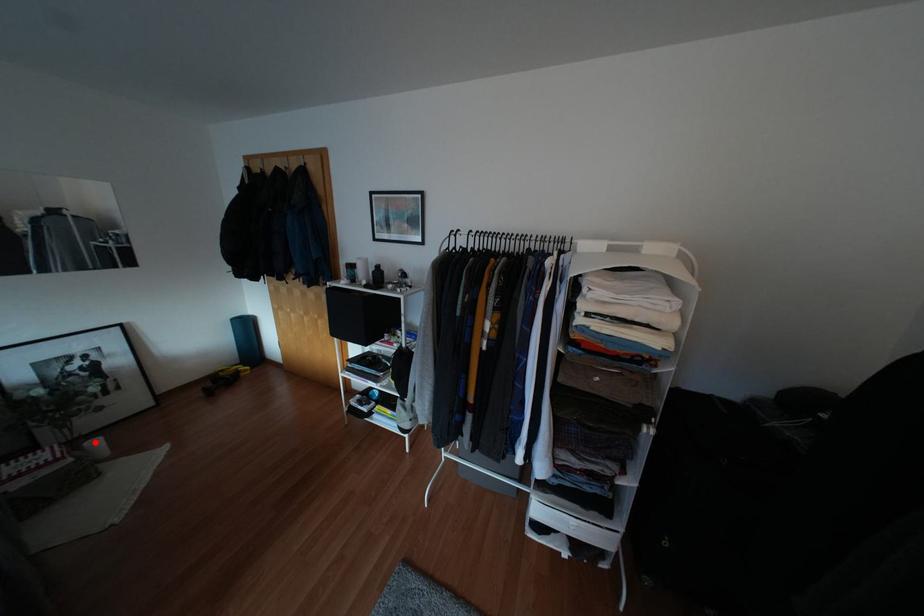
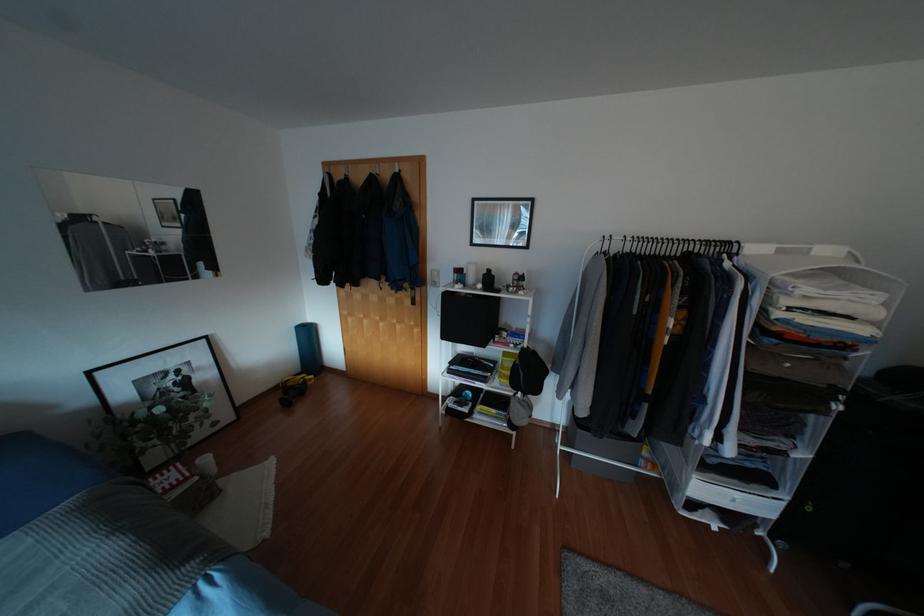
Question: I am providing you with two images of the same scene from different viewpoints. A red point is shown in image1. For the corresponding object point in image2, is it positioned nearer or farther from the camera?

Choices:
 (A) Nearer
 (B) Farther

Answer: (A)